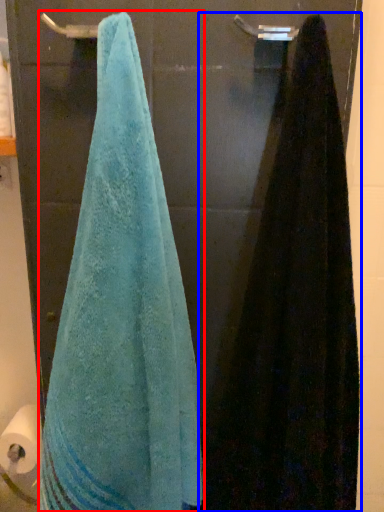
Question: Among these objects, which one is nearest to the camera, towel (highlighted by a red box) or towel (highlighted by a blue box)?

Choices:
 (A) towel
 (B) towel

Answer: (B)